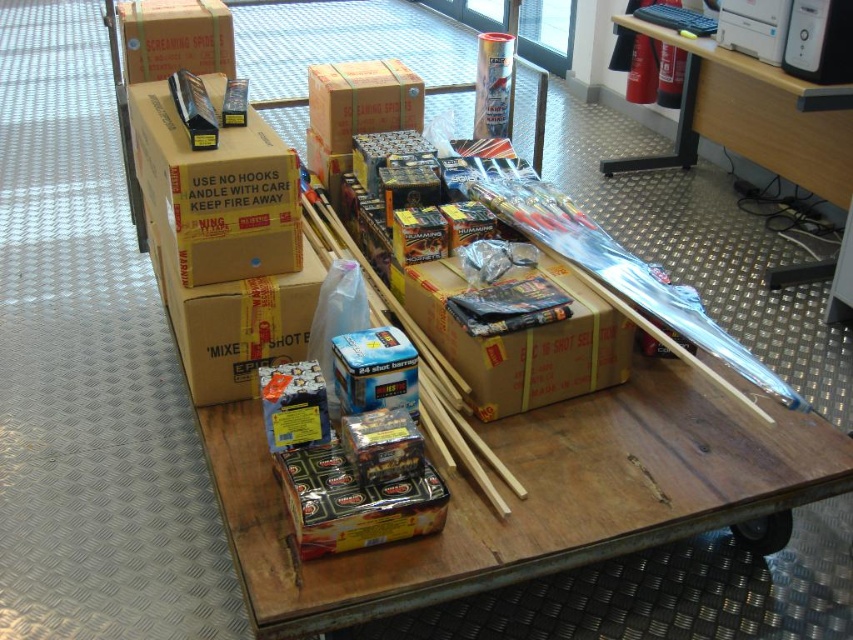
Which is below, brown cardboard box at upper left or brown cardboard box at center?

brown cardboard box at center is lower down.

Can you confirm if brown cardboard box at upper left is wider than brown cardboard box at center?

Correct, the width of brown cardboard box at upper left exceeds that of brown cardboard box at center.

Who is more distant from viewer, (219, 200) or (450, 342)?

The point (450, 342) is more distant.

What are the coordinates of `brown cardboard box at upper left` in the screenshot? It's located at (216, 193).

Who is more forward, (178, 243) or (125, 28)?

Point (178, 243)

Is brown cardboard box at upper left taller than matte cardboard box at upper left?

Yes, brown cardboard box at upper left is taller than matte cardboard box at upper left.

Is point (195, 161) positioned after point (149, 1)?

No, (195, 161) is in front of (149, 1).

Locate an element on the screen. Image resolution: width=853 pixels, height=640 pixels. brown cardboard box at upper left is located at coordinates tap(216, 193).

Is the position of matte cardboard box at center less distant than that of matte cardboard box at upper left?

Yes, matte cardboard box at center is in front of matte cardboard box at upper left.

Which is behind, point (189, 362) or point (166, 74)?

The point (166, 74) is behind.

Locate an element on the screen. matte cardboard box at center is located at coordinates (235, 323).